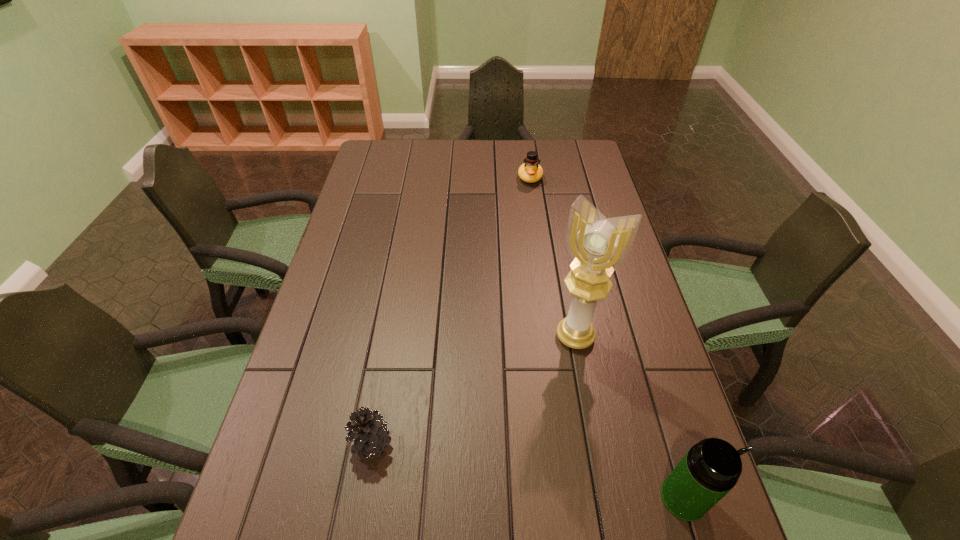
In order to click on vacant space positioned 0.180m on the front-facing side of the second farthest object in this screenshot , I will do `click(531, 407)`.

This screenshot has width=960, height=540. Find the location of `vacant region located 0.110m on the front-facing side of the farthest object`. vacant region located 0.110m on the front-facing side of the farthest object is located at coordinates (529, 206).

Where is `free space located 0.320m on the front-facing side of the farthest object`? The height and width of the screenshot is (540, 960). free space located 0.320m on the front-facing side of the farthest object is located at coordinates (527, 246).

This screenshot has width=960, height=540. Identify the location of free space located 0.150m on the front-facing side of the farthest object. (529, 213).

What are the coordinates of `object that is positioned at the far edge` in the screenshot? It's located at (530, 172).

Identify the location of object that is at the near edge. (711, 468).

Locate an element on the screen. The height and width of the screenshot is (540, 960). thermos bottle located in the right edge section of the desktop is located at coordinates (711, 468).

Identify the location of award that is at the right edge. This screenshot has width=960, height=540. (598, 245).

What are the coordinates of `object that is at the near right corner` in the screenshot? It's located at (711, 468).

Identify the location of vacant space at the far edge. (525, 148).